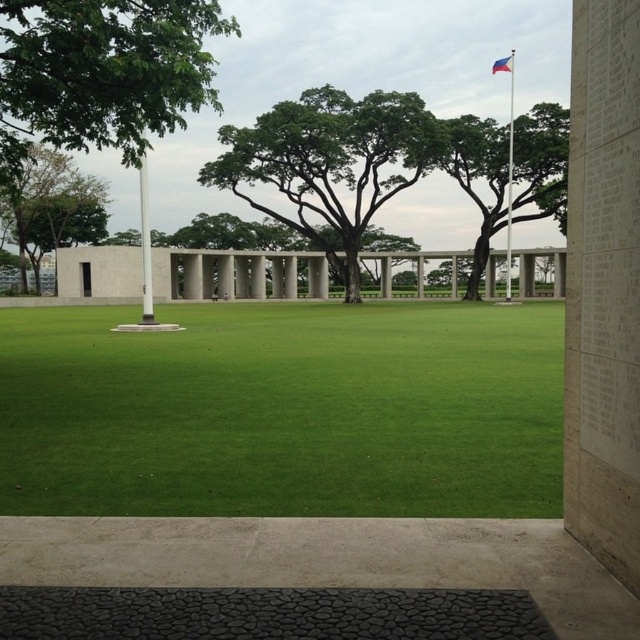
Question: Does green grass at center come behind blue fabric flag at upper right?

Choices:
 (A) yes
 (B) no

Answer: (B)

Question: Which point is farther from the camera taking this photo?

Choices:
 (A) (140, 211)
 (B) (316, 132)
 (C) (496, 156)

Answer: (A)

Question: Among these points, which one is nearest to the camera?

Choices:
 (A) (483, 208)
 (B) (627, 28)
 (C) (508, 291)

Answer: (B)

Question: Is green grass at center thinner than green leafy tree at upper center?

Choices:
 (A) no
 (B) yes

Answer: (A)

Question: Which of the following is the closest to the observer?

Choices:
 (A) white metallic flag pole at upper right
 (B) green leafy tree at left

Answer: (B)

Question: Is green leafy tree at upper center in front of white polished stone pillar at center?

Choices:
 (A) no
 (B) yes

Answer: (A)